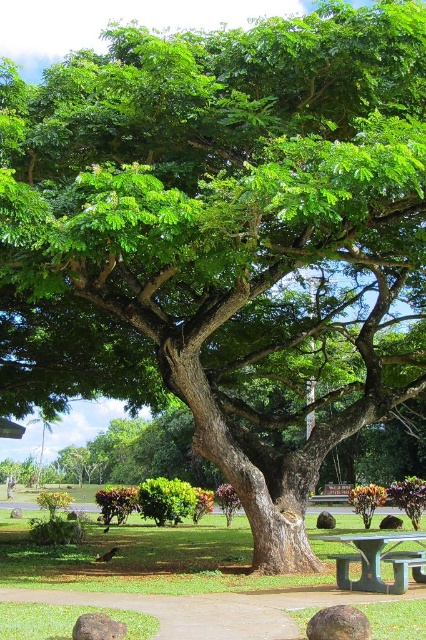
Which is behind, point (405, 524) or point (411, 557)?

Point (405, 524)

Can you confirm if green leafy tree at center is bigger than metallic silver bench at lower right?

Yes.

Identify the location of green leafy tree at center. (167, 577).

Is green plastic picnic table at lower center closer to the viewer compared to metallic silver bench at lower right?

No, it is not.

Can you confirm if green plastic picnic table at lower center is smaller than metallic silver bench at lower right?

No, green plastic picnic table at lower center is not smaller than metallic silver bench at lower right.

Locate an element on the screen. This screenshot has width=426, height=640. green plastic picnic table at lower center is located at coordinates (379, 561).

Is green leafy tree at center shorter than green plastic picnic table at lower center?

No.

The height and width of the screenshot is (640, 426). Describe the element at coordinates (167, 577) in the screenshot. I see `green leafy tree at center` at that location.

Locate an element on the screen. The image size is (426, 640). green leafy tree at center is located at coordinates (167, 577).